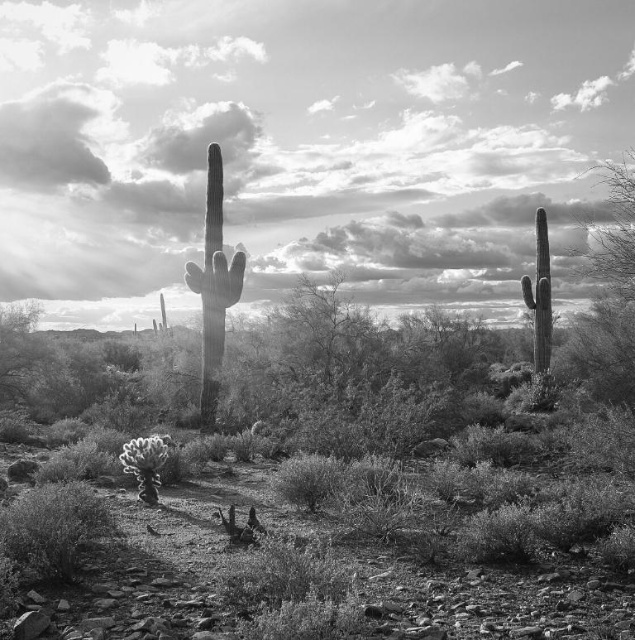
You are a desert explorer who just arrived at this desert landscape. You see the smooth green cactus at center and the smooth gray cactus at right. Which cactus is higher up in the image?

The smooth green cactus at center is higher up in the image than the smooth gray cactus at right.

You are standing in the desert scene and want to reach the point marked as point [297,120]. If your walking speed is 1.5 meters per second, how long will it take you to reach that point?

The point [297,120] is 72.83 meters from the camera. At a walking speed of 1.5 meters per second, it would take approximately 48.55 seconds to reach it.